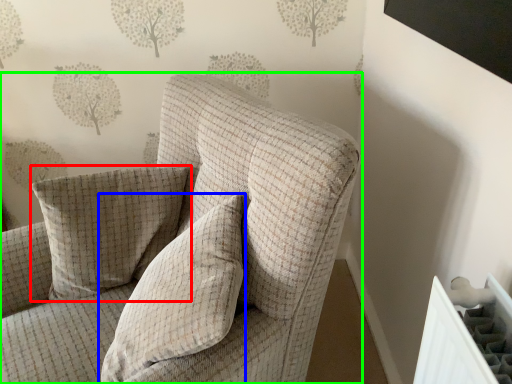
Question: Which object is the closest to the pillow (highlighted by a red box)? Choose among these: pillow (highlighted by a blue box) or chair (highlighted by a green box).

Choices:
 (A) pillow
 (B) chair

Answer: (B)